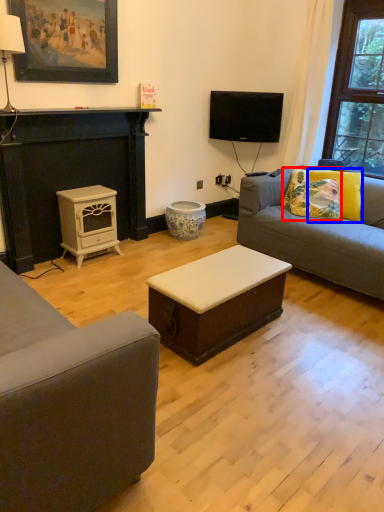
Question: Which object appears closest to the camera in this image, pillow (highlighted by a red box) or pillow (highlighted by a blue box)?

Choices:
 (A) pillow
 (B) pillow

Answer: (B)